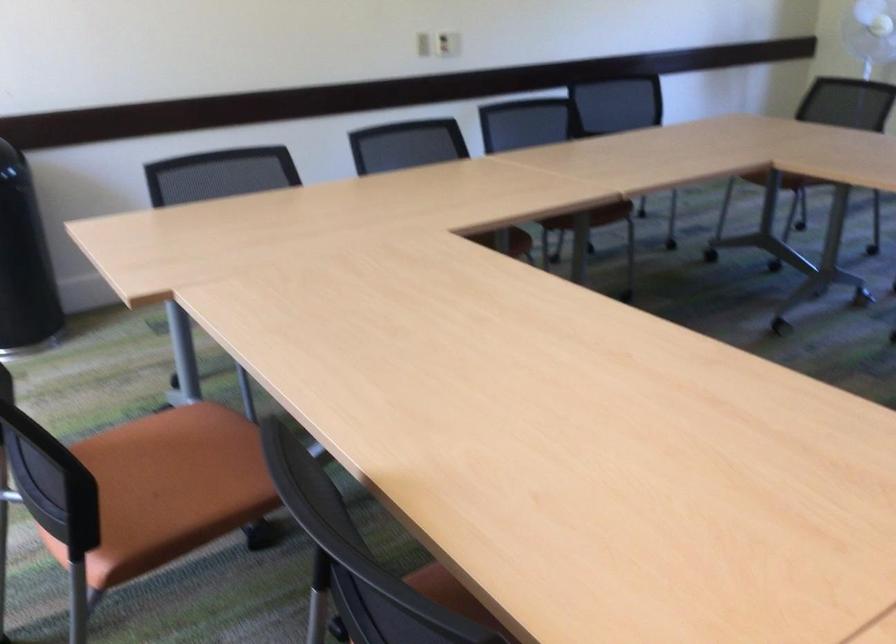
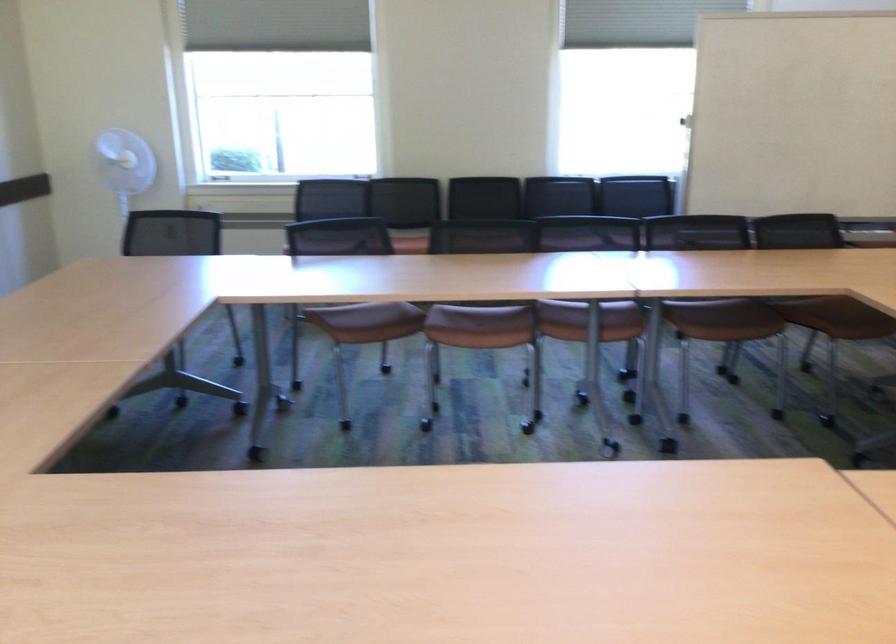
Locate, in the second image, the point that corresponds to point 728,152 in the first image.

(177, 292)